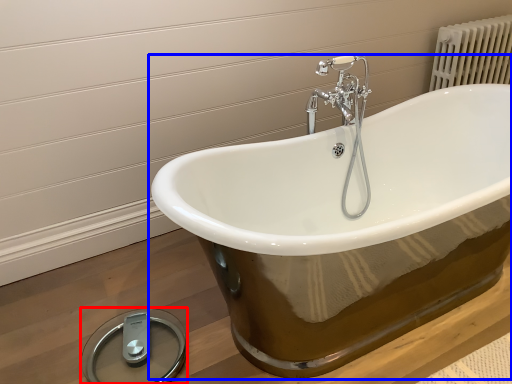
Question: Which object is further to the camera taking this photo, scale (highlighted by a red box) or bathtub (highlighted by a blue box)?

Choices:
 (A) scale
 (B) bathtub

Answer: (A)